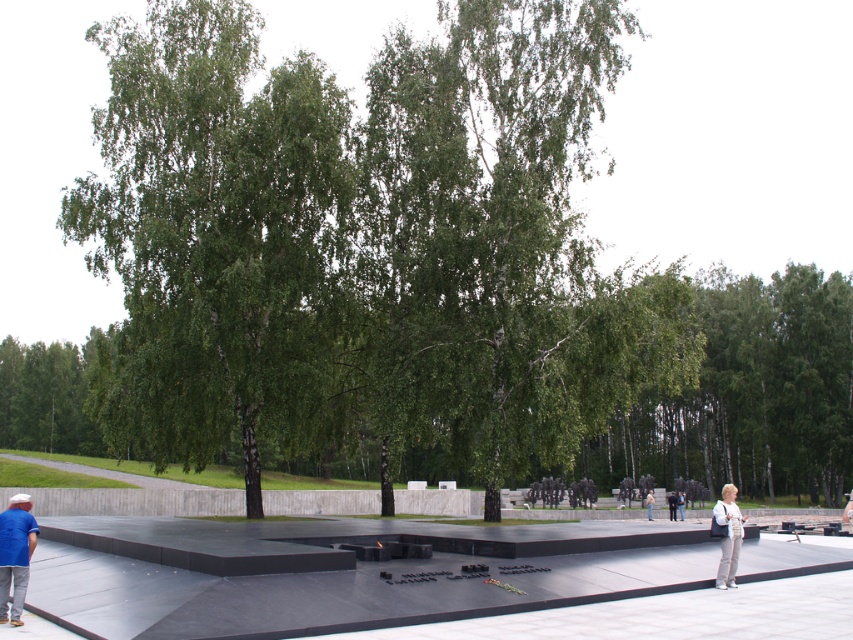
Between white fabric bag at lower right and light beige pants at center, which one is positioned lower?

light beige pants at center is lower down.

Between point (730, 560) and point (677, 515), which one is positioned in front?

Positioned in front is point (730, 560).

Find the location of a particular element. white fabric bag at lower right is located at coordinates (728, 536).

Between green leafy tree at center and dark gray pants at lower right, which one has less height?

dark gray pants at lower right is shorter.

Measure the distance between point (144,125) and camera.

Point (144,125) and camera are 26.32 meters apart from each other.

Locate an element on the screen. The height and width of the screenshot is (640, 853). green leafy tree at center is located at coordinates pos(213,234).

Which is behind, point (16, 497) or point (677, 509)?

Positioned behind is point (677, 509).

Who is more forward, (x=1, y=605) or (x=682, y=499)?

Point (x=1, y=605) is more forward.

At what (x,y) coordinates should I click in order to perform the action: click on blue cotton shirt at lower left. Please return your answer as a coordinate pair (x, y). Looking at the image, I should click on (15, 554).